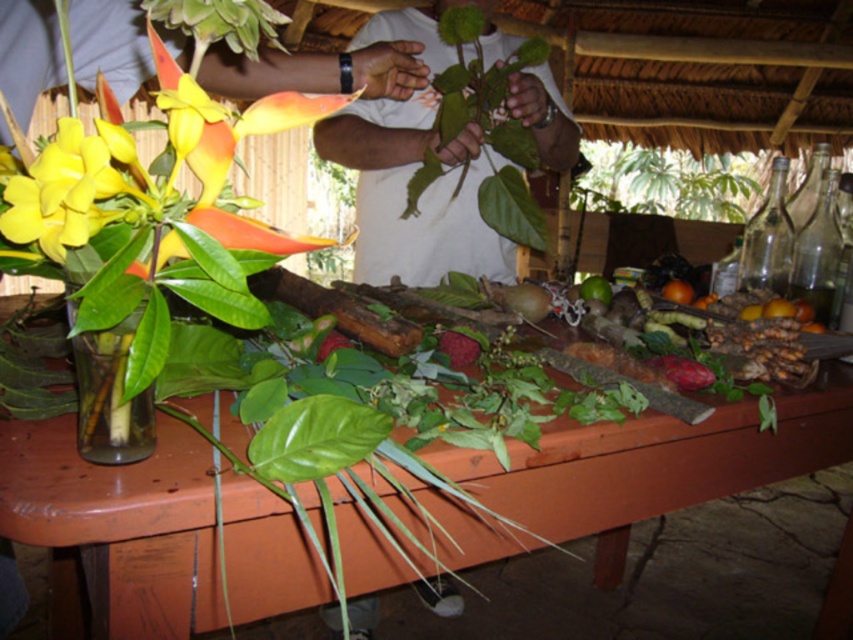
Who is positioned more to the left, green leafy plant at upper center or ripe red berry at center?

From the viewer's perspective, ripe red berry at center appears more on the left side.

Is green leafy plant at upper center positioned before ripe red berry at center?

No, it is not.

Between point (728, 186) and point (456, 333), which one is positioned behind?

Point (728, 186)

The image size is (853, 640). In order to click on green leafy plant at upper center in this screenshot , I will do `click(666, 182)`.

The image size is (853, 640). Describe the element at coordinates (666, 182) in the screenshot. I see `green leafy plant at upper center` at that location.

Can you confirm if green leafy plant at upper center is positioned below clear glass vase at left?

No, green leafy plant at upper center is not below clear glass vase at left.

Is point (709, 154) closer to camera compared to point (74, 285)?

That is False.

Locate an element on the screen. green leafy plant at upper center is located at coordinates (666, 182).

Can you confirm if wooden table at center is positioned to the right of green matte lime at center?

Incorrect, wooden table at center is not on the right side of green matte lime at center.

Is point (793, 470) farther from camera compared to point (585, 282)?

No, (793, 470) is in front of (585, 282).

The width and height of the screenshot is (853, 640). I want to click on wooden table at center, so click(654, 465).